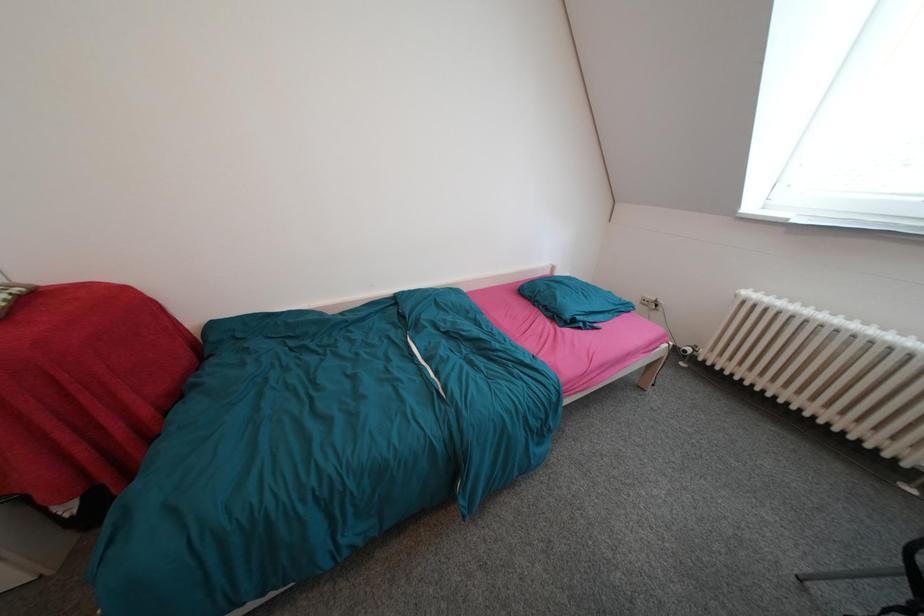
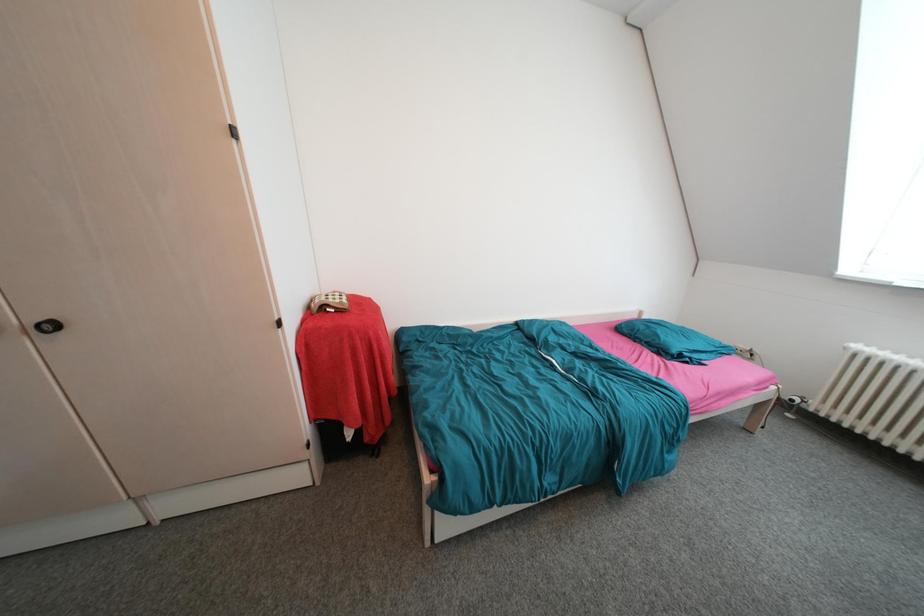
Consider the image. What movement of the cameraman would produce the second image?

The cameraman moved toward left, backward.